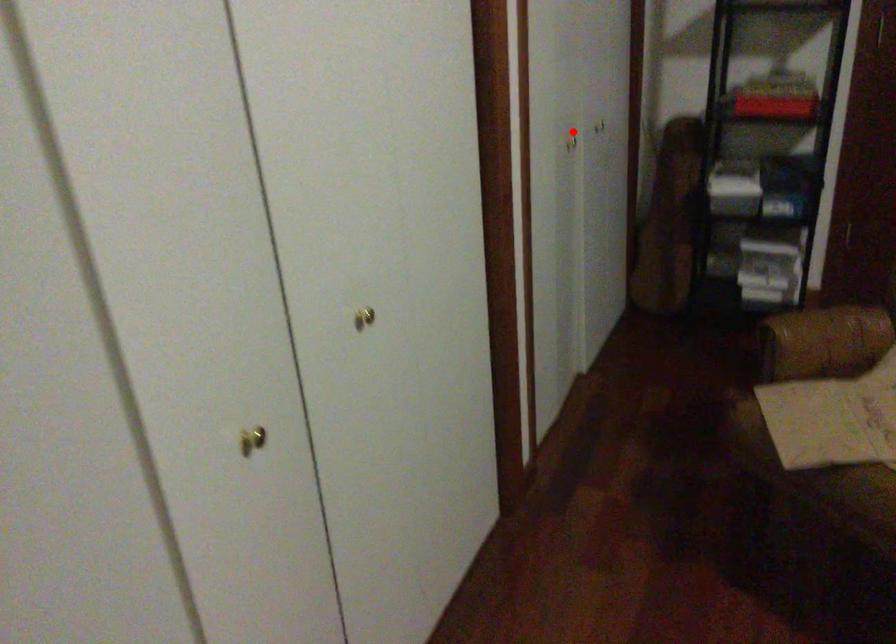
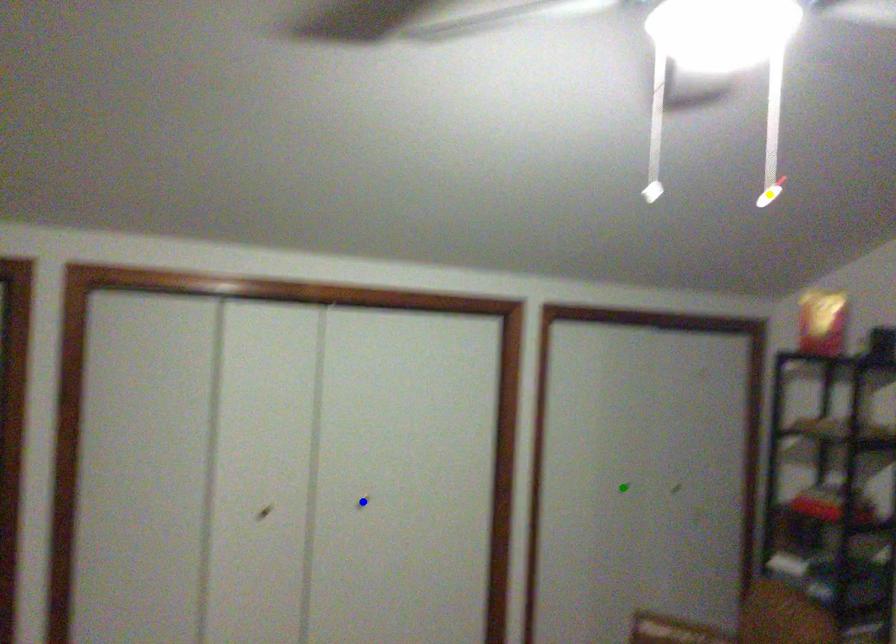
Question: I am providing you with two images of the same scene from different viewpoints. A red point is marked on the first image. You are given multiple points on the second image. Which point in image 2 is actually the same real-world point as the red point in image 1?

Choices:
 (A) yellow point
 (B) blue point
 (C) green point

Answer: (C)